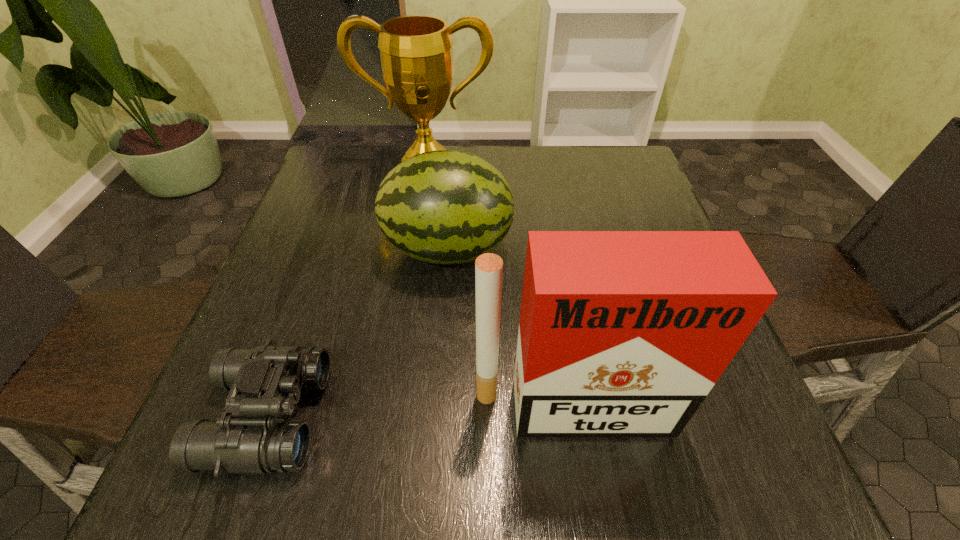
This screenshot has height=540, width=960. I want to click on award, so click(x=416, y=52).

The width and height of the screenshot is (960, 540). Find the location of `cigarette case`. cigarette case is located at coordinates (622, 333).

At what (x,y) coordinates should I click in order to perform the action: click on watermelon. Please return your answer as a coordinate pair (x, y). The height and width of the screenshot is (540, 960). Looking at the image, I should click on (445, 206).

At what (x,y) coordinates should I click in order to perform the action: click on the third nearest object. Please return your answer as a coordinate pair (x, y). The width and height of the screenshot is (960, 540). Looking at the image, I should click on (445, 206).

This screenshot has width=960, height=540. In order to click on the shortest object in this screenshot , I will do [x=264, y=382].

Image resolution: width=960 pixels, height=540 pixels. What are the coordinates of `vacant region located on the front-facing side of the farthest object` in the screenshot? It's located at (421, 198).

You are a GUI agent. You are given a task and a screenshot of the screen. Output one action in this format:
    pyautogui.click(x=<x>, y=<y>)
    Task: Click on the free point located on the front-facing side of the cigarette case
    The height and width of the screenshot is (540, 960).
    Given the screenshot: What is the action you would take?
    pyautogui.click(x=582, y=470)

I want to click on vacant space located at the stem end of the watermelon, so click(x=596, y=249).

This screenshot has height=540, width=960. I want to click on vacant space situated through the lenses of the shortest object, so pos(419,416).

You are a GUI agent. You are given a task and a screenshot of the screen. Output one action in this format:
    pyautogui.click(x=<x>, y=<y>)
    Task: Click on the object present at the far edge
    Image resolution: width=960 pixels, height=540 pixels.
    Given the screenshot: What is the action you would take?
    pyautogui.click(x=416, y=52)